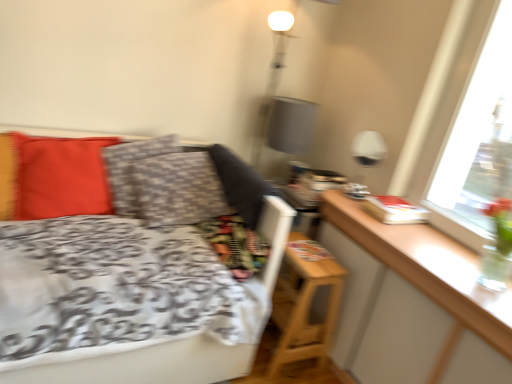
Question: Can you confirm if white glossy table lamp at upper right is thinner than wooden table at right?

Choices:
 (A) no
 (B) yes

Answer: (B)

Question: Is white glossy table lamp at upper right oriented away from wooden table at right?

Choices:
 (A) no
 (B) yes

Answer: (A)

Question: From a real-world perspective, does white glossy table lamp at upper right sit lower than wooden table at right?

Choices:
 (A) yes
 (B) no

Answer: (B)

Question: From the image's perspective, is white glossy table lamp at upper right located beneath wooden table at right?

Choices:
 (A) no
 (B) yes

Answer: (A)

Question: Considering the relative sizes of white glossy table lamp at upper right and wooden table at right in the image provided, is white glossy table lamp at upper right smaller than wooden table at right?

Choices:
 (A) no
 (B) yes

Answer: (B)

Question: Does point (340, 281) appear closer or farther from the camera than point (24, 213)?

Choices:
 (A) farther
 (B) closer

Answer: (A)

Question: From the image's perspective, relative to matte red pillow at left, the first pillow viewed from the left, is wooden nightstand at lower right above or below?

Choices:
 (A) below
 (B) above

Answer: (A)

Question: Considering the positions of wooden nightstand at lower right and matte red pillow at left, which is counted as the 2th pillow, starting from the right, in the image, is wooden nightstand at lower right wider or thinner than matte red pillow at left, which is counted as the 2th pillow, starting from the right,?

Choices:
 (A) wide
 (B) thin

Answer: (A)

Question: Relative to matte red pillow at left, the first pillow viewed from the left, is wooden nightstand at lower right in front or behind?

Choices:
 (A) front
 (B) behind

Answer: (B)

Question: From the image's perspective, is white glossy table lamp at upper right located above or below patterned fabric pillow at center, which appears as the 1th pillow when viewed from the right?

Choices:
 (A) above
 (B) below

Answer: (A)

Question: Is point (359, 160) closer or farther from the camera than point (162, 148)?

Choices:
 (A) closer
 (B) farther

Answer: (B)

Question: In the image, is white glossy table lamp at upper right positioned in front of or behind patterned fabric pillow at center, acting as the 2th pillow starting from the left?

Choices:
 (A) front
 (B) behind

Answer: (B)

Question: Looking at their shapes, would you say white glossy table lamp at upper right is wider or thinner than patterned fabric pillow at center, acting as the 2th pillow starting from the left?

Choices:
 (A) wide
 (B) thin

Answer: (B)

Question: From the image's perspective, is patterned fabric pillow at center, acting as the 2th pillow starting from the left, located above or below wooden table at right?

Choices:
 (A) above
 (B) below

Answer: (A)

Question: Considering the positions of patterned fabric pillow at center, which appears as the 1th pillow when viewed from the right, and wooden table at right in the image, is patterned fabric pillow at center, which appears as the 1th pillow when viewed from the right, wider or thinner than wooden table at right?

Choices:
 (A) wide
 (B) thin

Answer: (B)